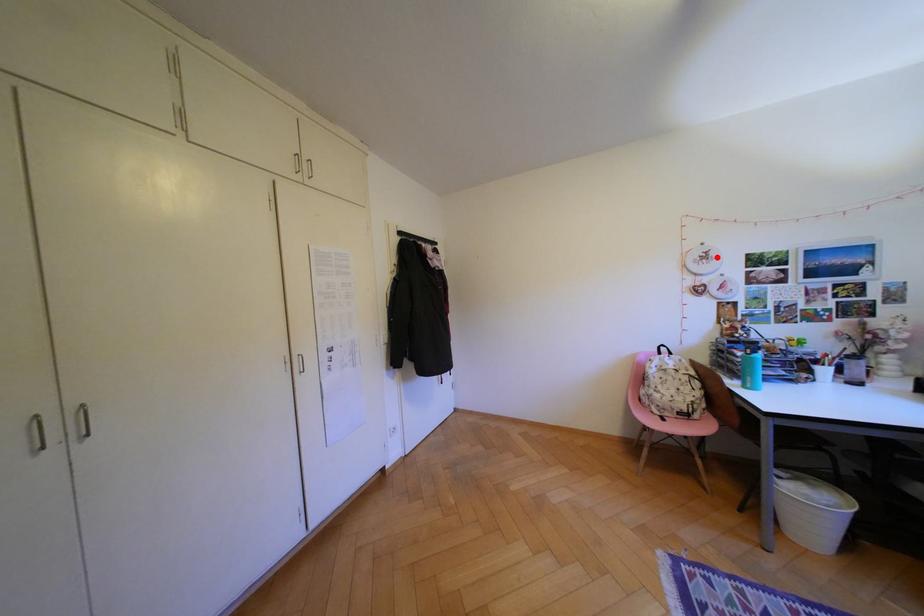
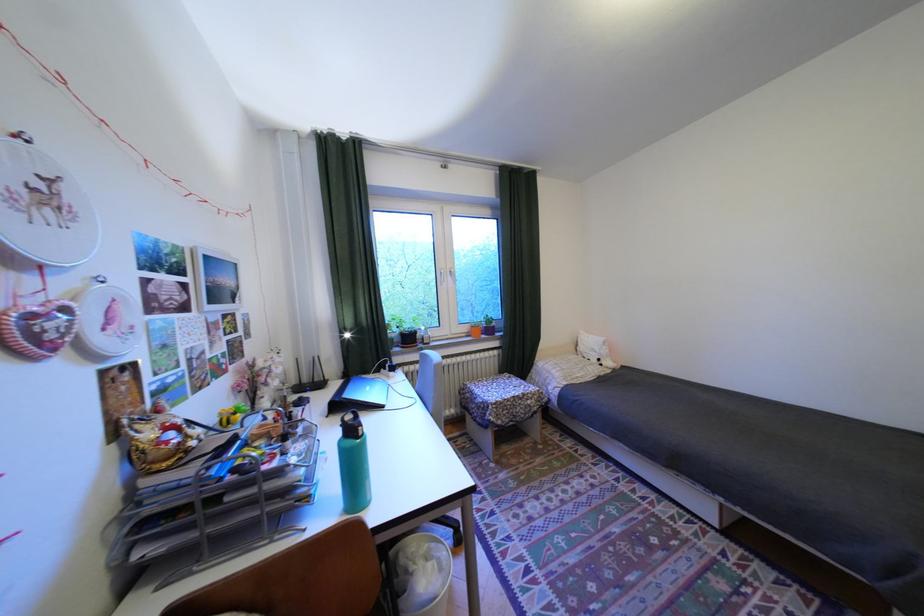
The point at the highlighted location is marked in the first image. Where is the corresponding point in the second image?

(58, 197)